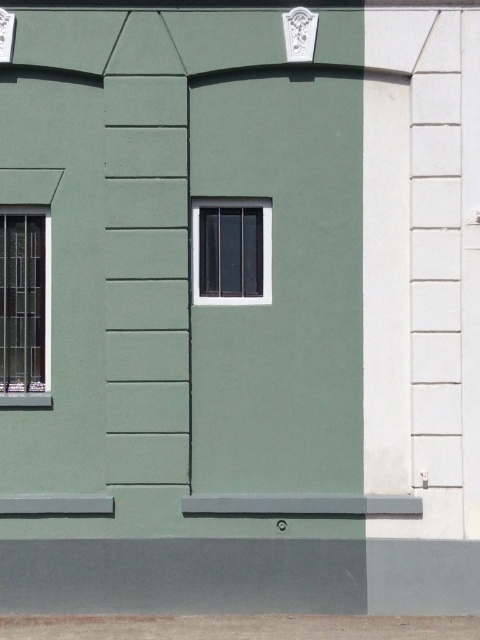
Does metallic grid window at left lie behind matte black window at center?

No, it is not.

The height and width of the screenshot is (640, 480). What are the coordinates of `metallic grid window at left` in the screenshot? It's located at (24, 307).

Find the location of `metallic grid window at left`. metallic grid window at left is located at coordinates (24, 307).